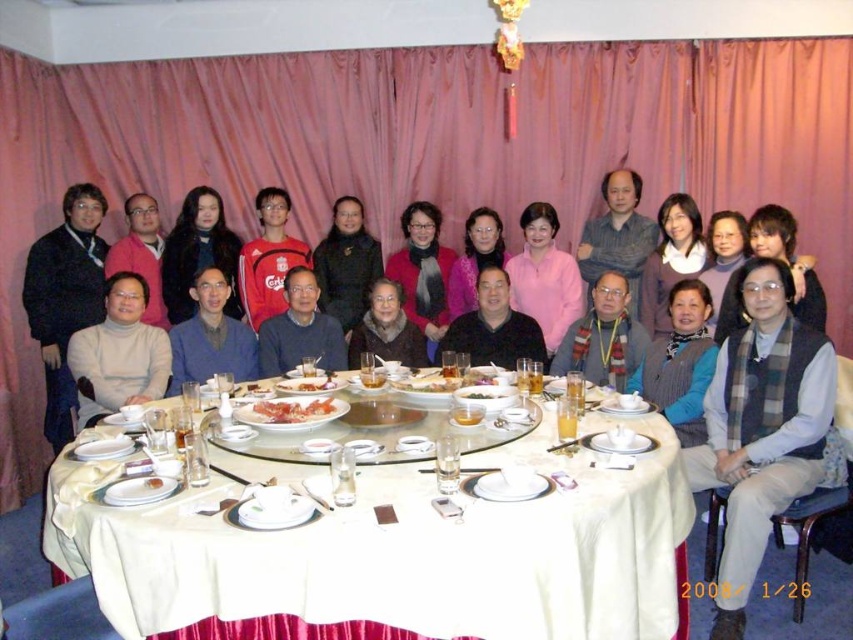
You are a guest at the banquet and want to retrieve your red adidas jacket at center without disturbing the gray wool vest at center. Is the jacket accessible?

The gray wool vest at center is located below the red adidas jacket at center, so the jacket is accessible as it is on top.

You are a guest at the banquet hall and want to place your phone on the table. The red adidas jacket at center is in the way. Where should you place your phone so it doesn not block the jacket?

Place your phone away from the red adidas jacket at center, which is located at point (268, 259). Since the jacket is at that specific coordinate, placing the phone elsewhere on the table would ensure it doesn t block the jacket.